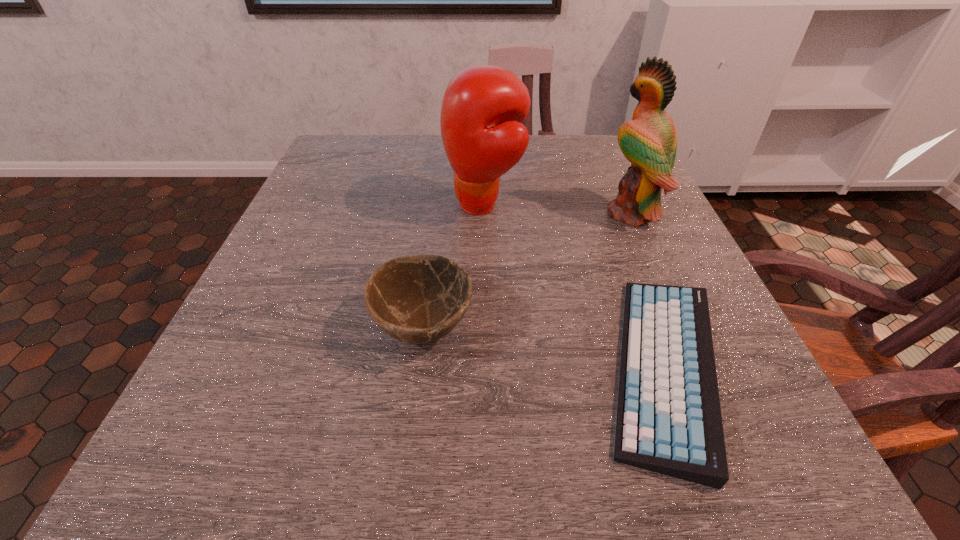
Identify the location of free space located 0.140m on the right of the third tallest object. The width and height of the screenshot is (960, 540). (561, 327).

This screenshot has width=960, height=540. Find the location of `free region located 0.400m on the back of the computer keyboard`. free region located 0.400m on the back of the computer keyboard is located at coordinates (592, 171).

What are the coordinates of `object that is at the near edge` in the screenshot? It's located at (669, 421).

This screenshot has width=960, height=540. In order to click on parrot located in the right edge section of the desktop in this screenshot , I will do `click(649, 141)`.

At what (x,y) coordinates should I click in order to perform the action: click on computer keyboard at the right edge. Please return your answer as a coordinate pair (x, y). Image resolution: width=960 pixels, height=540 pixels. Looking at the image, I should click on (669, 421).

Identify the location of object located in the near right corner section of the desktop. Image resolution: width=960 pixels, height=540 pixels. (669, 421).

Image resolution: width=960 pixels, height=540 pixels. In the image, there is a desktop. In order to click on free space at the far edge in this screenshot , I will do `click(422, 143)`.

I want to click on vacant space at the left edge, so click(x=324, y=224).

At what (x,y) coordinates should I click in order to perform the action: click on vacant space at the right edge. Please return your answer as a coordinate pair (x, y). Looking at the image, I should click on (761, 402).

Find the location of a particular element. This screenshot has width=960, height=540. free space at the far left corner of the desktop is located at coordinates (388, 152).